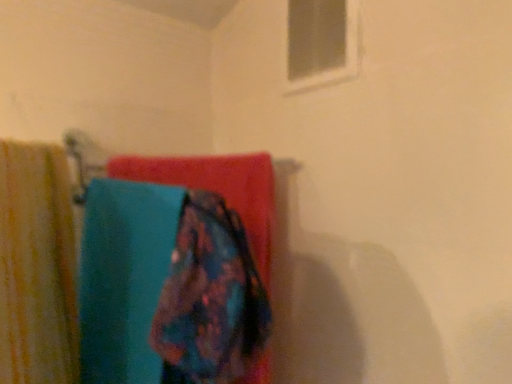
Describe the element at coordinates (37, 267) in the screenshot. I see `yellow striped fabric at left` at that location.

What is the approximate height of white plastic window at upper center?

The height of white plastic window at upper center is 9.29 inches.

Find the location of a particular element. The height and width of the screenshot is (384, 512). yellow striped fabric at left is located at coordinates (37, 267).

How far apart are floral fabric towel at center and white plastic window at upper center?

The distance of floral fabric towel at center from white plastic window at upper center is 9.40 inches.

Is floral fabric towel at center oriented towards white plastic window at upper center?

No, floral fabric towel at center is not facing towards white plastic window at upper center.

Which object is wider, floral fabric towel at center or white plastic window at upper center?

Wider between the two is floral fabric towel at center.

Considering the points (154, 159) and (313, 58), which point is in front, point (154, 159) or point (313, 58)?

The point (313, 58) is more forward.

Relative to floral fabric towel at center, is white plastic window at upper center in front or behind?

Clearly, white plastic window at upper center is behind floral fabric towel at center.

Does white plastic window at upper center appear on the left side of floral fabric towel at center?

No, white plastic window at upper center is not to the left of floral fabric towel at center.

Can you confirm if white plastic window at upper center is taller than floral fabric towel at center?

Yes.

Locate an element on the screen. This screenshot has width=512, height=384. window on the right of floral fabric towel at center is located at coordinates (321, 42).

Does floral fabric towel at center have a greater width compared to yellow striped fabric at left?

No, floral fabric towel at center is not wider than yellow striped fabric at left.

Does floral fabric towel at center touch yellow striped fabric at left?

floral fabric towel at center and yellow striped fabric at left are not in contact.

From a real-world perspective, which is physically above, floral fabric towel at center or yellow striped fabric at left?

From a 3D spatial view, floral fabric towel at center is above.

From the image's perspective, does yellow striped fabric at left appear lower than floral fabric towel at center?

Indeed, from the image's perspective, yellow striped fabric at left is shown beneath floral fabric towel at center.

Considering their positions, is yellow striped fabric at left located in front of or behind floral fabric towel at center?

In the image, yellow striped fabric at left appears in front of floral fabric towel at center.

Is yellow striped fabric at left to the right of floral fabric towel at center from the viewer's perspective?

In fact, yellow striped fabric at left is to the left of floral fabric towel at center.

Based on their sizes in the image, would you say yellow striped fabric at left is bigger or smaller than floral fabric towel at center?

yellow striped fabric at left is bigger than floral fabric towel at center.

Is white plastic window at upper center oriented away from yellow striped fabric at left?

No.

Can you confirm if white plastic window at upper center is bigger than yellow striped fabric at left?

Actually, white plastic window at upper center might be smaller than yellow striped fabric at left.

Would you say white plastic window at upper center is a long distance from yellow striped fabric at left?

white plastic window at upper center is actually quite close to yellow striped fabric at left.

Does point (8, 155) appear closer or farther from the camera than point (305, 39)?

Point (8, 155).

Is yellow striped fabric at left bigger than white plastic window at upper center?

Yes.

From the picture: From a real-world perspective, does yellow striped fabric at left sit lower than white plastic window at upper center?

Yes, from a real-world perspective, yellow striped fabric at left is under white plastic window at upper center.

Is yellow striped fabric at left far from white plastic window at upper center?

yellow striped fabric at left is near white plastic window at upper center, not far away.

Locate an element on the screen. The width and height of the screenshot is (512, 384). towel below the white plastic window at upper center (from the image's perspective) is located at coordinates (217, 188).

There is a floral fabric towel at center. At what (x,y) coordinates should I click in order to perform the action: click on window above it (from a real-world perspective). Please return your answer as a coordinate pair (x, y). Looking at the image, I should click on (321, 42).

Considering their positions, is yellow striped fabric at left positioned further to white plastic window at upper center than floral fabric towel at center?

yellow striped fabric at left.

Based on their spatial positions, is yellow striped fabric at left or white plastic window at upper center closer to floral fabric towel at center?

yellow striped fabric at left lies closer to floral fabric towel at center than the other object.

From the picture: Estimate the real-world distances between objects in this image. Which object is closer to white plastic window at upper center, floral fabric towel at center or yellow striped fabric at left?

floral fabric towel at center is closer to white plastic window at upper center.

Which object lies nearer to the anchor point floral fabric towel at center, white plastic window at upper center or yellow striped fabric at left?

Among the two, yellow striped fabric at left is located nearer to floral fabric towel at center.

Looking at the image, which one is located closer to yellow striped fabric at left, floral fabric towel at center or white plastic window at upper center?

floral fabric towel at center is positioned closer to the anchor yellow striped fabric at left.

When comparing their distances from yellow striped fabric at left, does white plastic window at upper center or floral fabric towel at center seem further?

Based on the image, white plastic window at upper center appears to be further to yellow striped fabric at left.

Identify the location of towel that lies between white plastic window at upper center and yellow striped fabric at left from top to bottom. (217, 188).